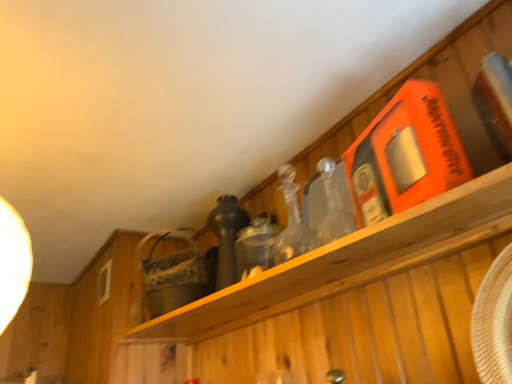
The height and width of the screenshot is (384, 512). Find the location of `shiny dark glass bottle at center`. shiny dark glass bottle at center is located at coordinates (227, 237).

Describe the element at coordinates (227, 237) in the screenshot. This screenshot has width=512, height=384. I see `shiny dark glass bottle at center` at that location.

Where is `woven straw basket at center`? The image size is (512, 384). woven straw basket at center is located at coordinates (172, 275).

Describe the element at coordinates (172, 275) in the screenshot. I see `woven straw basket at center` at that location.

Where is `shiny dark glass bottle at center`? This screenshot has height=384, width=512. shiny dark glass bottle at center is located at coordinates (227, 237).

Considering the positions of objects woven straw basket at center and shiny dark glass bottle at center in the image provided, who is more to the right, woven straw basket at center or shiny dark glass bottle at center?

shiny dark glass bottle at center.

Is woven straw basket at center behind shiny dark glass bottle at center?

Yes, woven straw basket at center is further from the camera.

Which is in front, point (203, 291) or point (236, 229)?

Point (236, 229)

From the image's perspective, which object appears higher, woven straw basket at center or shiny dark glass bottle at center?

From the image's view, shiny dark glass bottle at center is above.

From a real-world perspective, between woven straw basket at center and shiny dark glass bottle at center, who is vertically lower?

From a 3D spatial view, shiny dark glass bottle at center is below.

Between woven straw basket at center and shiny dark glass bottle at center, which one has smaller width?

shiny dark glass bottle at center is thinner.

From the picture: Between woven straw basket at center and shiny dark glass bottle at center, which one has more height?

Standing taller between the two is woven straw basket at center.

Considering the sizes of objects woven straw basket at center and shiny dark glass bottle at center in the image provided, who is smaller, woven straw basket at center or shiny dark glass bottle at center?

shiny dark glass bottle at center.

Do you think woven straw basket at center is within shiny dark glass bottle at center, or outside of it?

woven straw basket at center is located beyond the bounds of shiny dark glass bottle at center.

Are woven straw basket at center and shiny dark glass bottle at center beside each other?

No, woven straw basket at center is not making contact with shiny dark glass bottle at center.

Is woven straw basket at center turned away from shiny dark glass bottle at center?

woven straw basket at center does not have its back to shiny dark glass bottle at center.

Can you tell me how much woven straw basket at center and shiny dark glass bottle at center differ in facing direction?

There is a 5.38-degree angle between the facing directions of woven straw basket at center and shiny dark glass bottle at center.

Measure the distance from woven straw basket at center to shiny dark glass bottle at center.

woven straw basket at center is 7.77 inches away from shiny dark glass bottle at center.

This screenshot has width=512, height=384. I want to click on bottle lying above the woven straw basket at center (from the image's perspective), so click(227, 237).

Does shiny dark glass bottle at center appear on the right side of woven straw basket at center?

Correct, you'll find shiny dark glass bottle at center to the right of woven straw basket at center.

Relative to woven straw basket at center, is shiny dark glass bottle at center in front or behind?

shiny dark glass bottle at center is positioned closer to the viewer than woven straw basket at center.

Between point (239, 219) and point (152, 297), which one is positioned in front?

The point (239, 219) is closer to the camera.

From the image's perspective, is shiny dark glass bottle at center above woven straw basket at center?

Yes, from the image's perspective, shiny dark glass bottle at center is on top of woven straw basket at center.

From a real-world perspective, between shiny dark glass bottle at center and woven straw basket at center, who is vertically lower?

shiny dark glass bottle at center.

Is shiny dark glass bottle at center wider than woven straw basket at center?

Incorrect, the width of shiny dark glass bottle at center does not surpass that of woven straw basket at center.

Considering the relative sizes of shiny dark glass bottle at center and woven straw basket at center in the image provided, is shiny dark glass bottle at center shorter than woven straw basket at center?

Yes.

Which of these two, shiny dark glass bottle at center or woven straw basket at center, is bigger?

Bigger between the two is woven straw basket at center.

Is woven straw basket at center inside shiny dark glass bottle at center?

No.

Would you say shiny dark glass bottle at center is a long distance from woven straw basket at center?

No, shiny dark glass bottle at center is not far away from woven straw basket at center.

Is shiny dark glass bottle at center oriented towards woven straw basket at center?

No, shiny dark glass bottle at center is not turned towards woven straw basket at center.

How distant is shiny dark glass bottle at center from woven straw basket at center?

shiny dark glass bottle at center is 7.77 inches away from woven straw basket at center.

Locate an element on the screen. Image resolution: width=512 pixels, height=384 pixels. bottle above the woven straw basket at center (from the image's perspective) is located at coordinates (227, 237).

What are the coordinates of `basket on the left of shiny dark glass bottle at center` in the screenshot? It's located at (172, 275).

Locate an element on the screen. bottle in front of the woven straw basket at center is located at coordinates (227, 237).